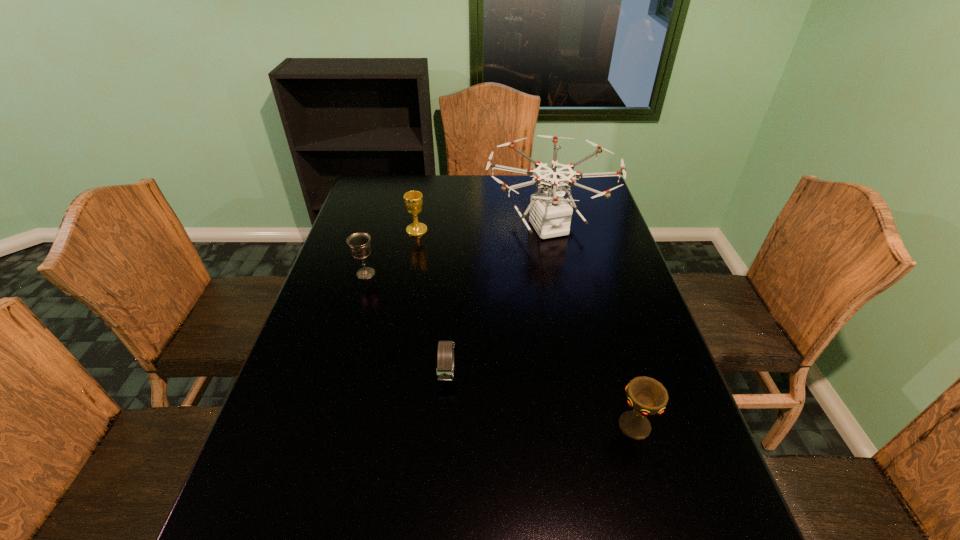
Where is `the tallest object`? This screenshot has height=540, width=960. the tallest object is located at coordinates (550, 214).

Find the location of a particular element. the second chalice from right to left is located at coordinates (413, 200).

You are a GUI agent. You are given a task and a screenshot of the screen. Output one action in this format:
    pyautogui.click(x=<x>, y=<y>)
    Task: Click on the farthest chalice
    This screenshot has height=540, width=960.
    Given the screenshot: What is the action you would take?
    pyautogui.click(x=413, y=200)

Find the location of a particular element. The height and width of the screenshot is (540, 960). the leftmost object is located at coordinates (359, 243).

You are a GUI agent. You are given a task and a screenshot of the screen. Output one action in this format:
    pyautogui.click(x=<x>, y=<y>)
    Task: Click on the second nearest chalice
    The width and height of the screenshot is (960, 540).
    Given the screenshot: What is the action you would take?
    pyautogui.click(x=359, y=243)

Where is `the rightmost chalice`? The image size is (960, 540). the rightmost chalice is located at coordinates (647, 396).

Locate an element on the screen. The image size is (960, 540). the nearest object is located at coordinates (647, 396).

Image resolution: width=960 pixels, height=540 pixels. I want to click on the fourth farthest object, so click(445, 355).

Find the location of a particular element. The width and height of the screenshot is (960, 540). the third object from right to left is located at coordinates (445, 355).

The height and width of the screenshot is (540, 960). What are the coordinates of `blank area located on the front of the tallest object` in the screenshot? It's located at (573, 347).